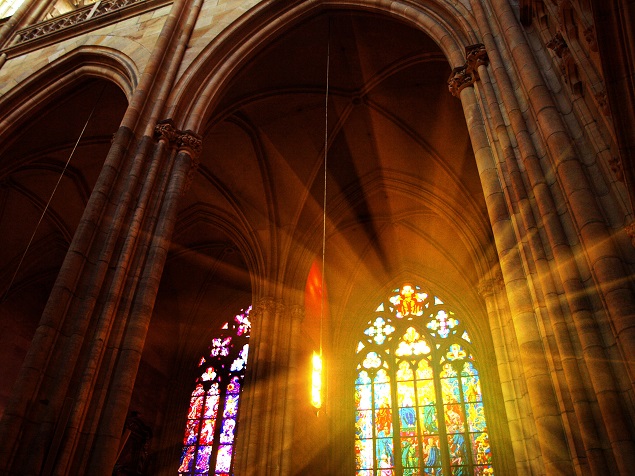
Locate an element on the screen. blue stained glass on right window is located at coordinates (409, 415), (388, 455), (406, 456), (436, 416), (431, 456).